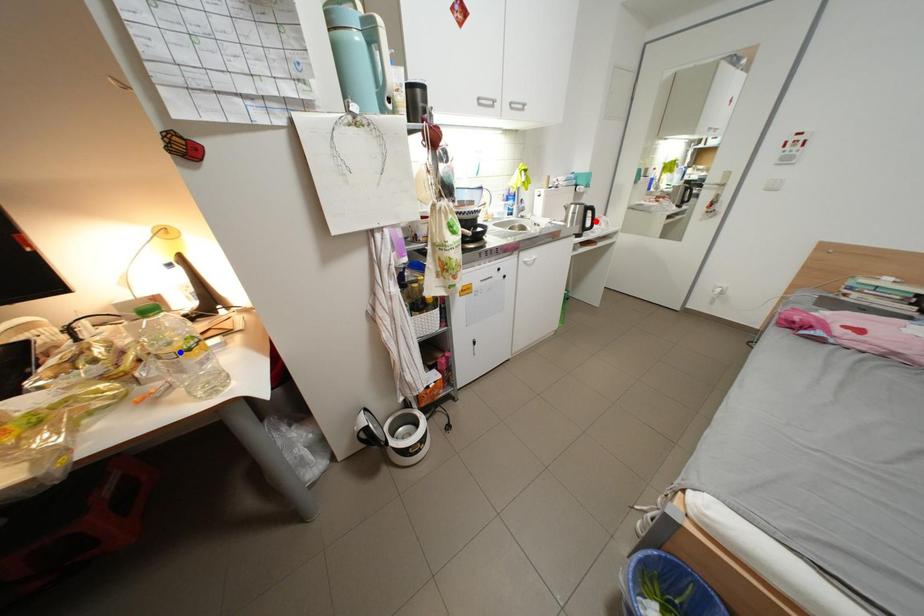
Question: Two points are marked on the image. Which point is closer to the camera?

Choices:
 (A) Blue point is closer.
 (B) Red point is closer.

Answer: (A)